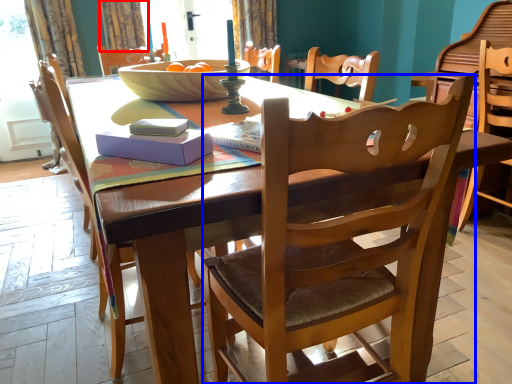
Question: Which object appears farthest to the camera in this image, curtain (highlighted by a red box) or chair (highlighted by a blue box)?

Choices:
 (A) curtain
 (B) chair

Answer: (A)